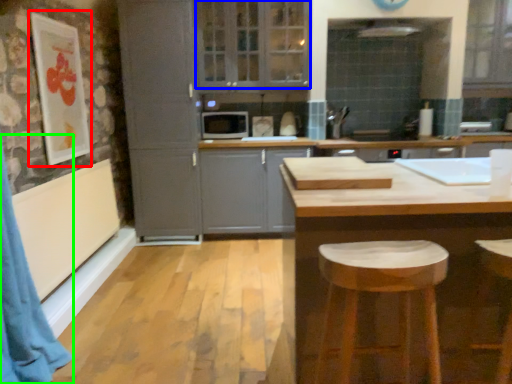
Question: Which object is the closest to the picture frame (highlighted by a red box)? Choose among these: window (highlighted by a blue box) or curtain (highlighted by a green box).

Choices:
 (A) window
 (B) curtain

Answer: (B)